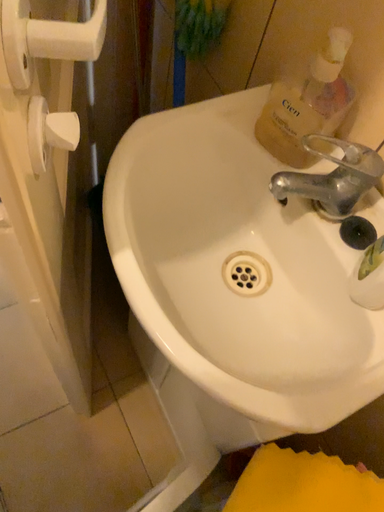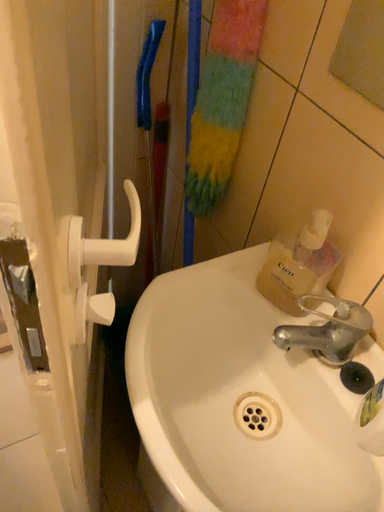
Question: Which way did the camera rotate in the video?

Choices:
 (A) rotated downward
 (B) rotated upward

Answer: (B)